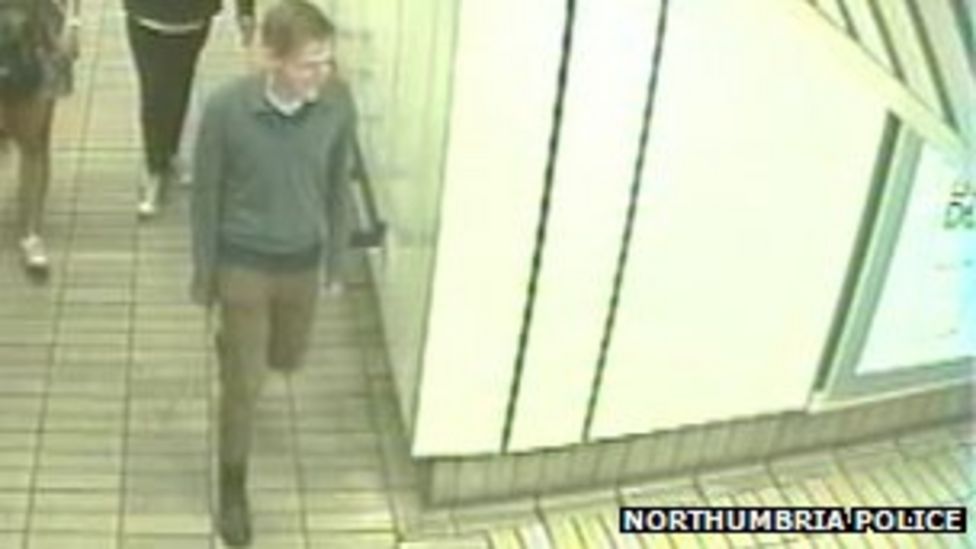
In order to click on picture frame in this screenshot , I will do `click(896, 187)`, `click(910, 384)`.